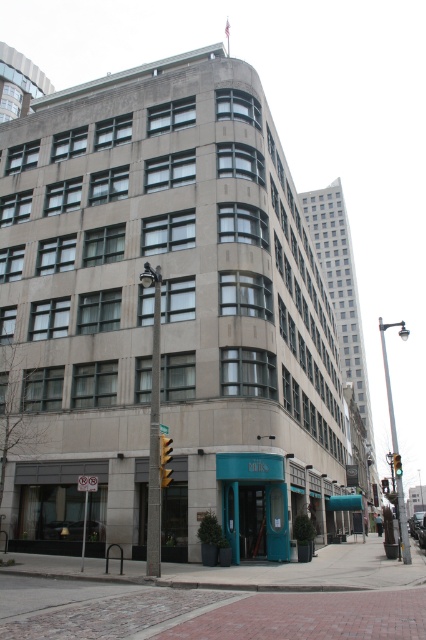
Can you confirm if yellow plastic traffic light at lower center is positioned to the right of green glass traffic light at upper right?

In fact, yellow plastic traffic light at lower center is to the left of green glass traffic light at upper right.

Who is positioned more to the right, yellow plastic traffic light at lower center or green glass traffic light at upper right?

green glass traffic light at upper right is more to the right.

Does point (161, 449) come closer to viewer compared to point (396, 465)?

That is True.

The image size is (426, 640). Find the location of `yellow plastic traffic light at lower center`. yellow plastic traffic light at lower center is located at coordinates (164, 449).